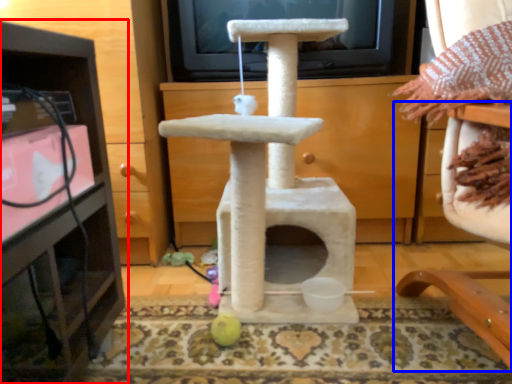
Question: Which object appears closest to the camera in this image, furniture (highlighted by a red box) or furniture (highlighted by a blue box)?

Choices:
 (A) furniture
 (B) furniture

Answer: (B)